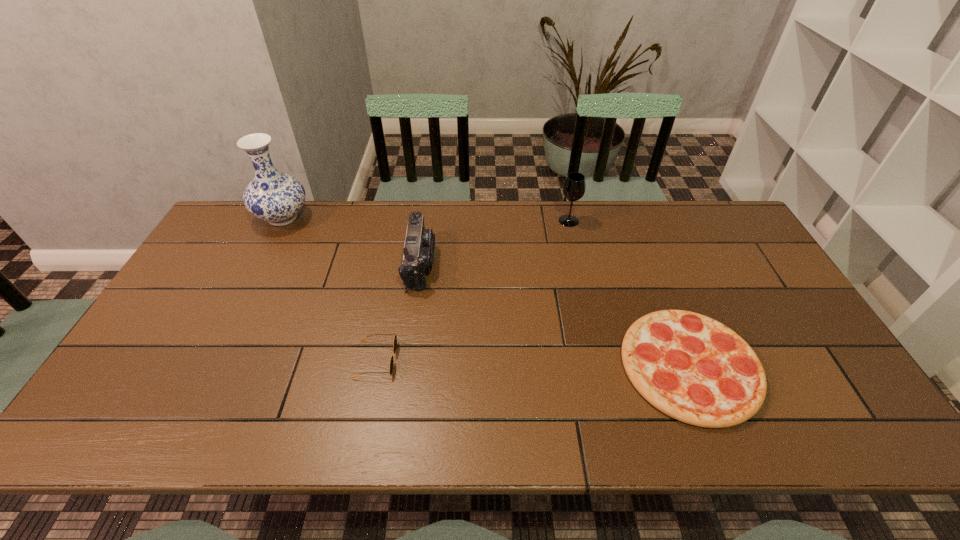
The width and height of the screenshot is (960, 540). Identify the location of vacant space that is in between the fourth object from left to right and the camcorder. (494, 242).

At what (x,y) coordinates should I click in order to perform the action: click on vacant region between the sunglasses and the rightmost object. Please return your answer as a coordinate pair (x, y). This screenshot has width=960, height=540. Looking at the image, I should click on (533, 363).

Where is `empty space between the leftmost object and the pizza`? This screenshot has height=540, width=960. empty space between the leftmost object and the pizza is located at coordinates point(486,292).

The height and width of the screenshot is (540, 960). Find the location of `vacant area that lies between the leftmost object and the shortest object`. vacant area that lies between the leftmost object and the shortest object is located at coordinates (486, 292).

Identify the location of object that stands as the fourth closest to the pizza. (273, 196).

Identify which object is located as the second nearest to the pizza. Please provide its 2D coordinates. Your answer should be formatted as a tuple, i.e. [(x, y)], where the tuple contains the x and y coordinates of a point satisfying the conditions above.

[(418, 254)]

Where is `vacant area in the image that satisfies the following two spatial constraints: 1. on the front-facing side of the sunglasses; 2. on the right side of the rightmost object`? vacant area in the image that satisfies the following two spatial constraints: 1. on the front-facing side of the sunglasses; 2. on the right side of the rightmost object is located at coordinates (374, 367).

Where is `blank space that satisfies the following two spatial constraints: 1. on the front side of the rightmost object; 2. on the right side of the vase`? The image size is (960, 540). blank space that satisfies the following two spatial constraints: 1. on the front side of the rightmost object; 2. on the right side of the vase is located at coordinates (206, 367).

Where is `free region that satisfies the following two spatial constraints: 1. on the front side of the wineglass; 2. on the right side of the leftmost object`? This screenshot has width=960, height=540. free region that satisfies the following two spatial constraints: 1. on the front side of the wineglass; 2. on the right side of the leftmost object is located at coordinates (281, 221).